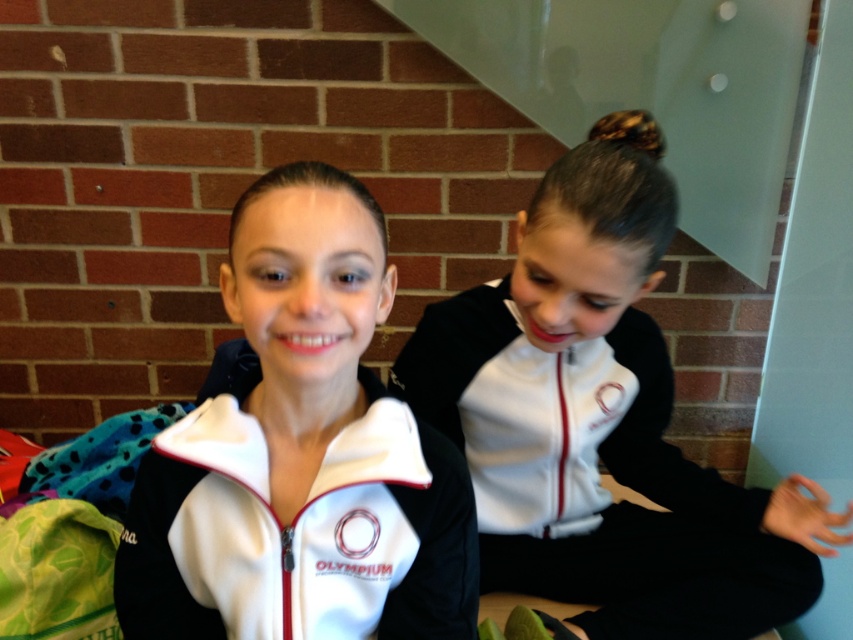
Question: Does white matte jacket at center appear on the right side of white matte jacket at right?

Choices:
 (A) no
 (B) yes

Answer: (A)

Question: Among these points, which one is farthest from the camera?

Choices:
 (A) (664, 516)
 (B) (334, 538)

Answer: (A)

Question: Which point is farther to the camera?

Choices:
 (A) white matte jacket at right
 (B) white matte jacket at center

Answer: (A)

Question: Does white matte jacket at center have a smaller size compared to white matte jacket at right?

Choices:
 (A) yes
 (B) no

Answer: (A)

Question: Can you confirm if white matte jacket at center is positioned to the right of white matte jacket at right?

Choices:
 (A) no
 (B) yes

Answer: (A)

Question: Which point appears closest to the camera in this image?

Choices:
 (A) (373, 506)
 (B) (482, 568)

Answer: (A)